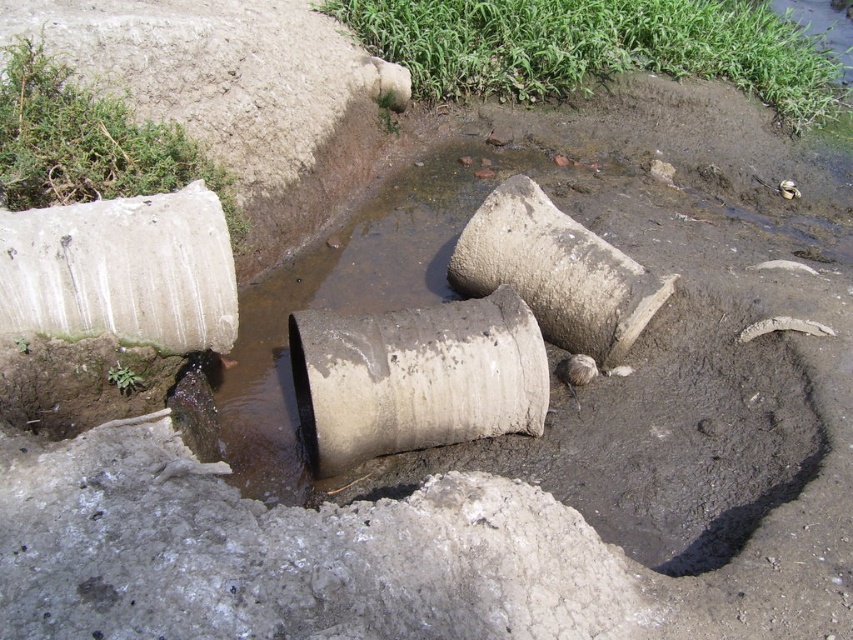
Is muddy concrete pipe at center wider than gray concrete water pipe at center?

Correct, the width of muddy concrete pipe at center exceeds that of gray concrete water pipe at center.

Between muddy concrete pipe at center and gray concrete water pipe at center, which one appears on the right side from the viewer's perspective?

gray concrete water pipe at center is more to the right.

Between point (309, 401) and point (515, 204), which one is positioned behind?

Point (515, 204)

Image resolution: width=853 pixels, height=640 pixels. I want to click on muddy concrete pipe at center, so click(415, 378).